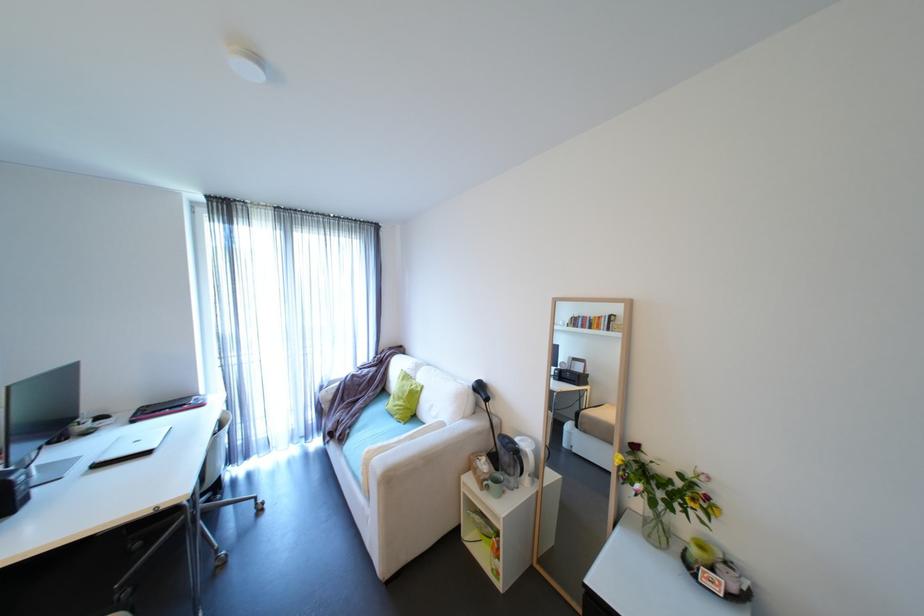
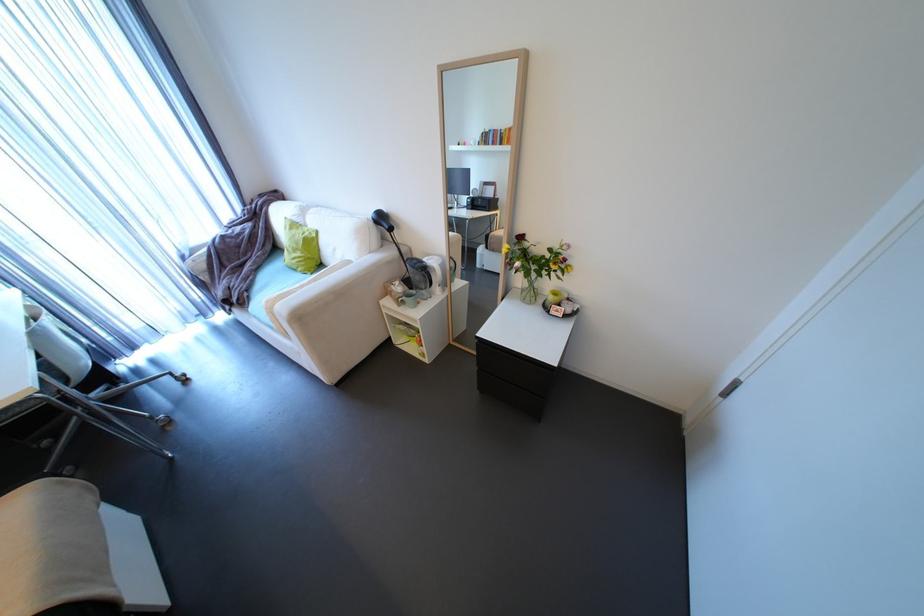
The point at (638,450) is marked in the first image. Where is the corresponding point in the second image?

(524, 241)